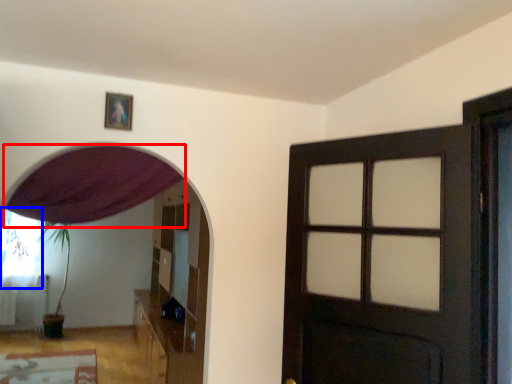
Question: Which point is closer to the camera, curtain (highlighted by a red box) or curtain (highlighted by a blue box)?

Choices:
 (A) curtain
 (B) curtain

Answer: (A)